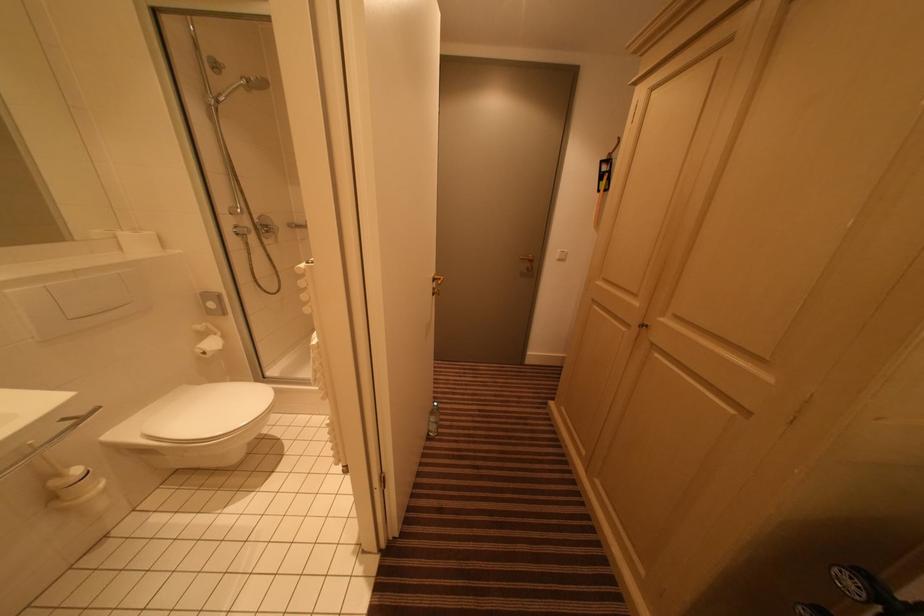
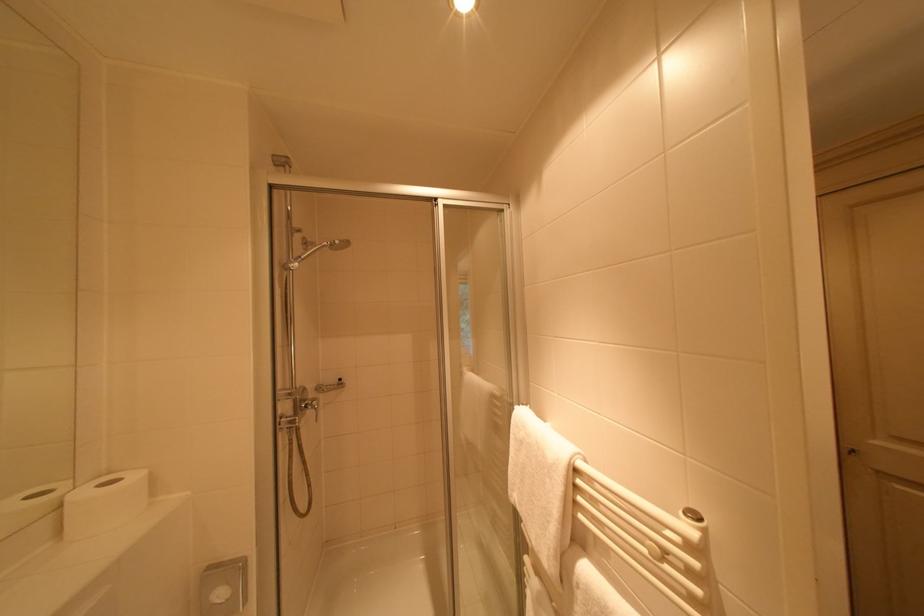
Question: I am providing you with two images of the same scene from different viewpoints. Please identify which objects are invisible in image2.

Choices:
 (A) handheld shower head
 (B) square wall button
 (C) white toilet paper
 (D) none of these

Answer: (D)